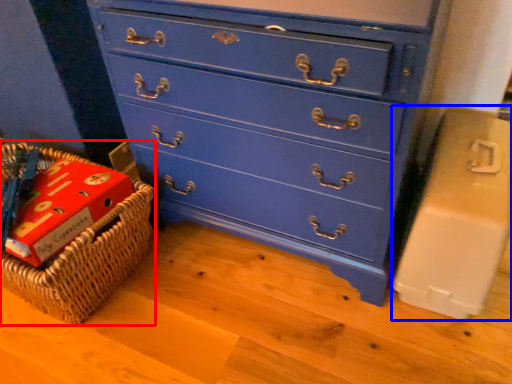
Question: Which object is further to the camera taking this photo, basket (highlighted by a red box) or cardboard box (highlighted by a blue box)?

Choices:
 (A) basket
 (B) cardboard box

Answer: (A)